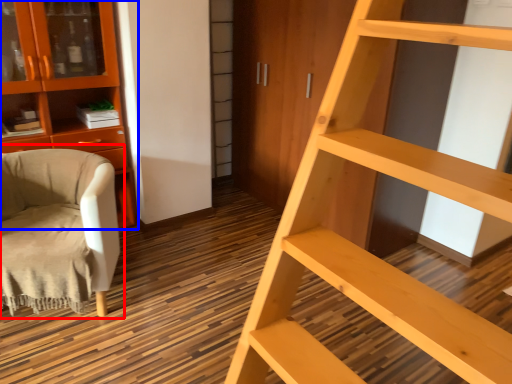
Question: Among these objects, which one is farthest to the camera, chair (highlighted by a red box) or cabinetry (highlighted by a blue box)?

Choices:
 (A) chair
 (B) cabinetry

Answer: (B)